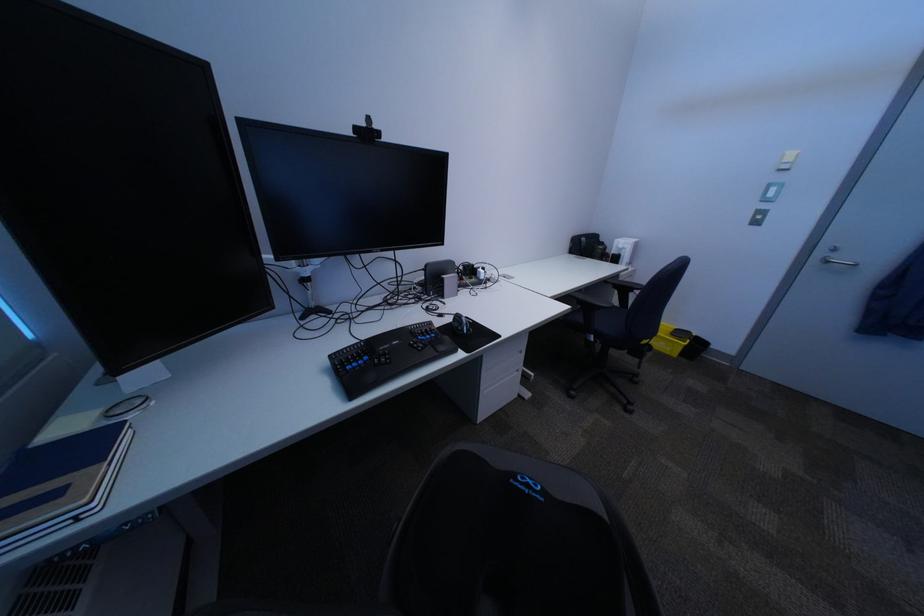
Where is `silver door handle`? The width and height of the screenshot is (924, 616). silver door handle is located at coordinates (835, 260).